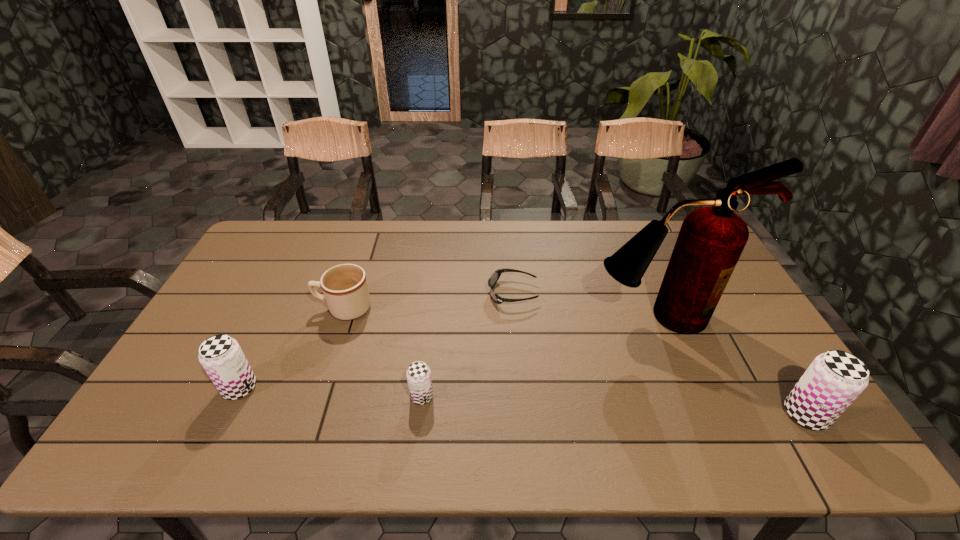
At what (x,y) coordinates should I click in order to perform the action: click on beer can that is at the right edge. Please return your answer as a coordinate pair (x, y). The height and width of the screenshot is (540, 960). Looking at the image, I should click on (834, 379).

Image resolution: width=960 pixels, height=540 pixels. Identify the location of fire extinguisher located in the right edge section of the desktop. [711, 240].

Locate an element on the screen. object situated at the near left corner is located at coordinates (221, 356).

I want to click on object that is at the near right corner, so click(834, 379).

The height and width of the screenshot is (540, 960). In the image, there is a desktop. Identify the location of vacant region at the far edge. (468, 230).

Locate an element on the screen. Image resolution: width=960 pixels, height=540 pixels. blank space at the near edge of the desktop is located at coordinates (509, 392).

You are a GUI agent. You are given a task and a screenshot of the screen. Output one action in this format:
    pyautogui.click(x=<x>, y=<y>)
    Task: Click on the free location at the left edge
    
    Given the screenshot: What is the action you would take?
    pyautogui.click(x=264, y=263)

The width and height of the screenshot is (960, 540). Identify the location of vacant space at the right edge of the desktop. (732, 296).

In the image, there is a desktop. Identify the location of vacant space at the far left corner. This screenshot has height=540, width=960. (258, 238).

In the image, there is a desktop. At what (x,y) coordinates should I click in order to perform the action: click on vacant space at the near left corner. Please return your answer as a coordinate pair (x, y). Looking at the image, I should click on (175, 400).